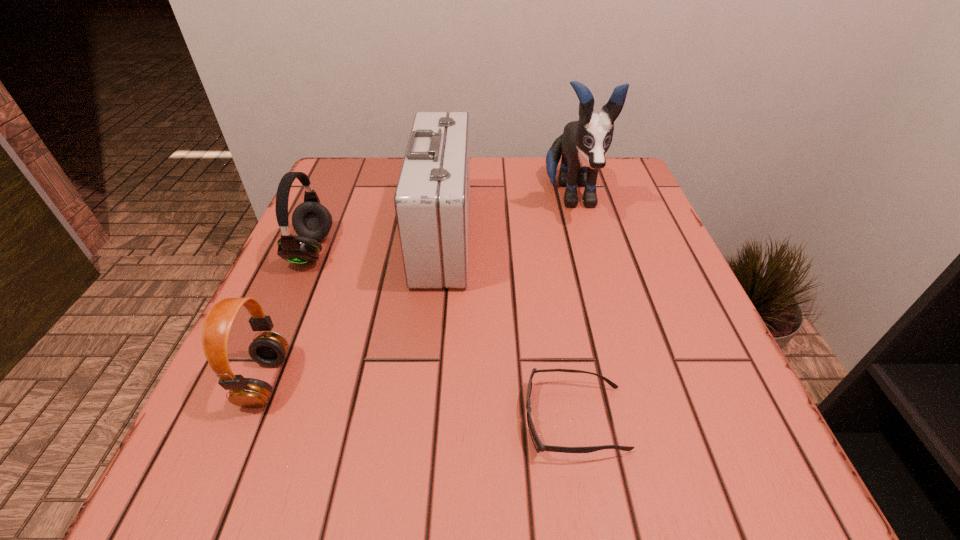
Locate an element on the screen. the tallest object is located at coordinates (583, 145).

Locate an element on the screen. The image size is (960, 540). the third object from left to right is located at coordinates (432, 199).

Where is `the first-aid kit`? The height and width of the screenshot is (540, 960). the first-aid kit is located at coordinates (432, 199).

Image resolution: width=960 pixels, height=540 pixels. In order to click on the farther headset in this screenshot , I will do `click(312, 222)`.

Identify the location of the nearer headset. (269, 348).

At what (x,y) coordinates should I click in order to perform the action: click on sunglasses. Please return your answer as a coordinate pair (x, y). This screenshot has height=540, width=960. Looking at the image, I should click on (539, 447).

Locate an element on the screen. vacant space located on the front-facing side of the puppy is located at coordinates (611, 340).

I want to click on vacant point located 0.270m on the front-facing side of the second tallest object, so click(596, 236).

Image resolution: width=960 pixels, height=540 pixels. What are the coordinates of `vacant space located on the ear cups of the farther headset` in the screenshot? It's located at (459, 250).

The image size is (960, 540). In order to click on vacant space situated on the ear cups of the nearer headset in this screenshot , I will do `click(416, 381)`.